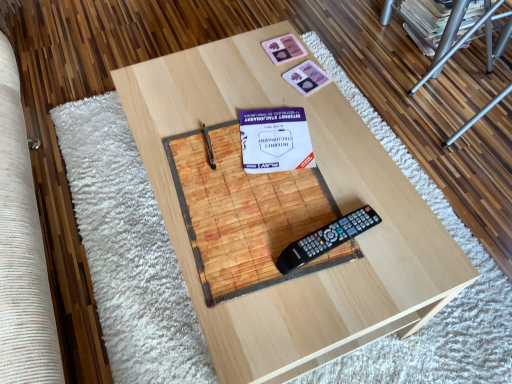
At what (x,y) coordinates should I click in order to perform the action: click on vacant space that is in between black plastic remote control at center and pink matte playing card at upper center, acting as the 1th square starting from the bottom. Please return your answer as a coordinate pair (x, y). Looking at the image, I should click on (322, 164).